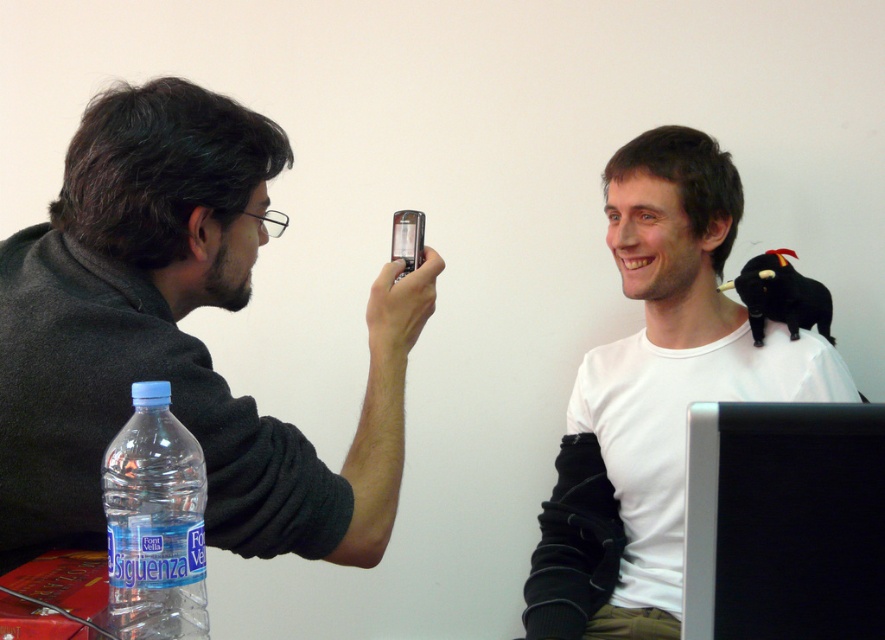
Question: Can you confirm if black glossy monitor at lower right is positioned to the left of satin black phone at center?

Choices:
 (A) no
 (B) yes

Answer: (A)

Question: Which object is the farthest from the satin black phone at center?

Choices:
 (A) transparent plastic bottle at lower left
 (B) white matte plush toy at upper right

Answer: (B)

Question: Does black glossy monitor at lower right have a larger size compared to transparent plastic bottle at lower left?

Choices:
 (A) no
 (B) yes

Answer: (A)

Question: Is matte black phone at left to the right of transparent plastic bottle at lower left from the viewer's perspective?

Choices:
 (A) yes
 (B) no

Answer: (B)

Question: Which point is farther to the camera?

Choices:
 (A) matte black phone at left
 (B) satin black phone at center
 (C) white matte plush toy at upper right
 (D) black glossy monitor at lower right

Answer: (C)

Question: Which point is farther to the camera?

Choices:
 (A) (595, 618)
 (B) (417, 212)
 (C) (820, 572)
 (D) (25, 312)

Answer: (A)